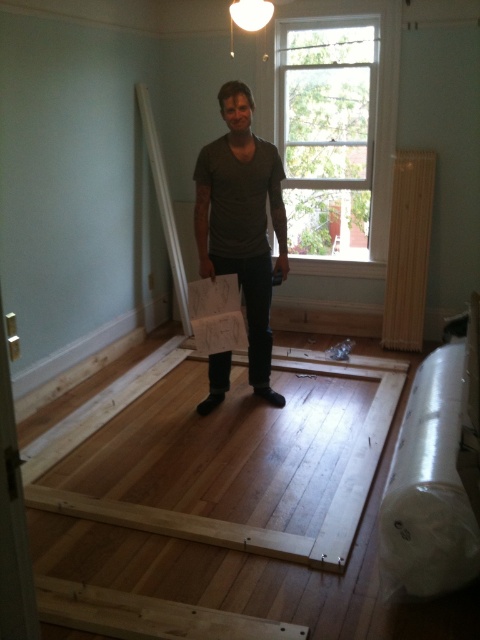
Question: Among these objects, which one is nearest to the camera?

Choices:
 (A) white wood window at upper center
 (B) matte gray shirt at center

Answer: (B)

Question: Is white wood window at upper center to the left of matte gray shirt at center from the viewer's perspective?

Choices:
 (A) yes
 (B) no

Answer: (B)

Question: Among these points, which one is nearest to the camera?

Choices:
 (A) (229, 124)
 (B) (300, 58)

Answer: (A)

Question: Can you confirm if white wood window at upper center is positioned to the left of matte gray shirt at center?

Choices:
 (A) no
 (B) yes

Answer: (A)

Question: Does white wood window at upper center have a lesser width compared to matte gray shirt at center?

Choices:
 (A) no
 (B) yes

Answer: (A)